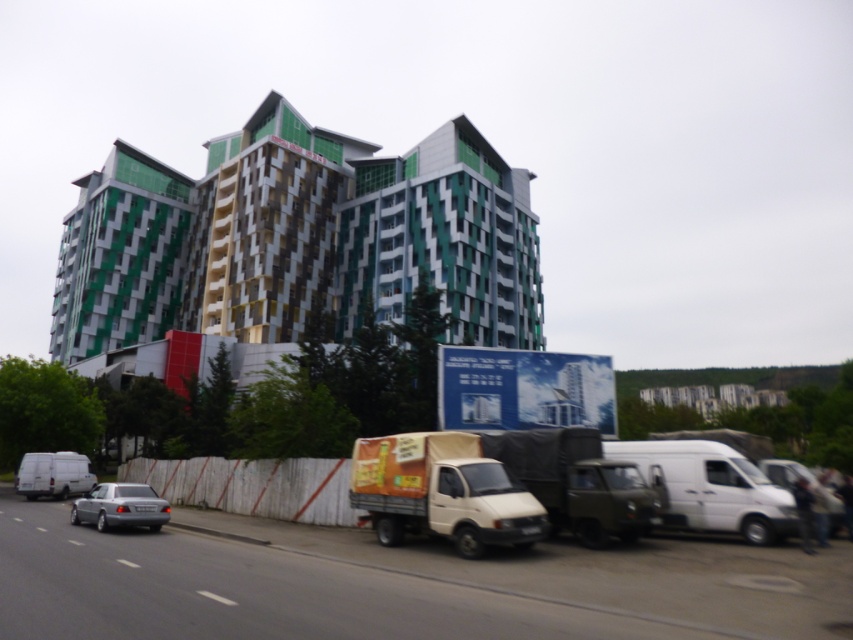
Who is lower down, white matte truck at center or matte white truck at center?

white matte truck at center is below.

In the scene shown: Is white matte truck at center in front of matte white truck at center?

Yes, it is.

At what (x,y) coordinates should I click in order to perform the action: click on white matte truck at center. Please return your answer as a coordinate pair (x, y). This screenshot has width=853, height=640. Looking at the image, I should click on (442, 492).

Where is `white matte truck at center`? The height and width of the screenshot is (640, 853). white matte truck at center is located at coordinates (442, 492).

Between matte white truck at center and white matte van at lower left, which one has less height?

white matte van at lower left is shorter.

Between point (509, 435) and point (44, 465), which one is positioned in front?

Point (509, 435) is more forward.

Image resolution: width=853 pixels, height=640 pixels. I want to click on matte white truck at center, so click(x=577, y=483).

From the picture: Measure the distance between silver metallic sedan at lower left and white matte van at lower left.

3.35 meters

From the picture: Which is below, silver metallic sedan at lower left or white matte van at lower left?

silver metallic sedan at lower left

Image resolution: width=853 pixels, height=640 pixels. I want to click on silver metallic sedan at lower left, so click(120, 506).